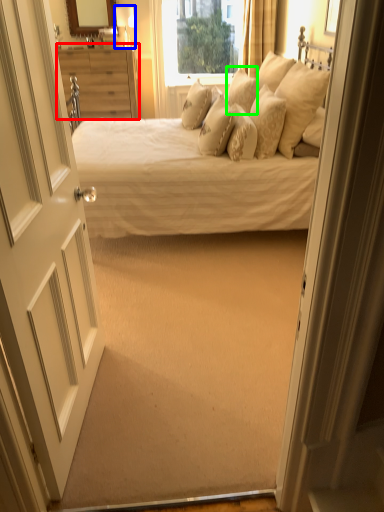
Question: Estimate the real-world distances between objects in this image. Which object is closer to nightstand (highlighted by a red box), lamp (highlighted by a blue box) or pillow (highlighted by a green box)?

Choices:
 (A) lamp
 (B) pillow

Answer: (A)